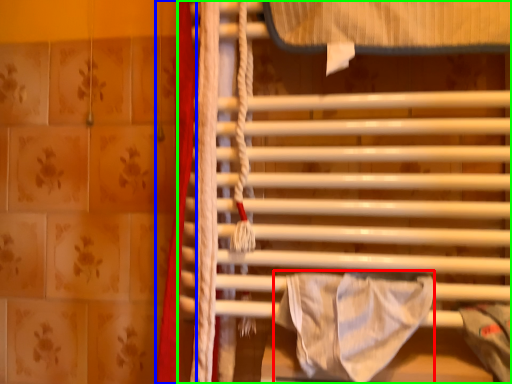
Question: Estimate the real-world distances between objects in this image. Which object is closer to blanket (highlighted by a red box), curtain (highlighted by a blue box) or furniture (highlighted by a green box)?

Choices:
 (A) curtain
 (B) furniture

Answer: (B)